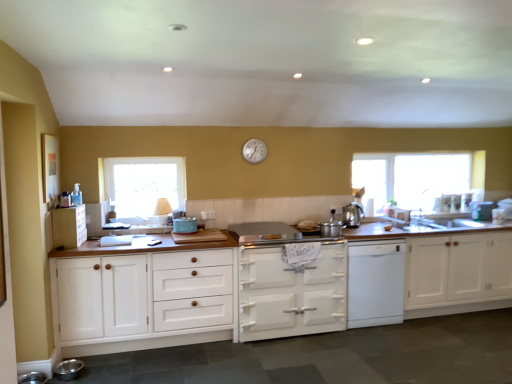
Question: From a real-world perspective, is white glossy stove at center, placed as the 2th cabinetry when sorted from right to left, above or below white wood cabinet at left, acting as the 2th cabinetry starting from the left?

Choices:
 (A) below
 (B) above

Answer: (A)

Question: Is white glossy stove at center, positioned as the 3th cabinetry in left-to-right order, wider or thinner than white wood cabinet at left, the third cabinetry positioned from the right?

Choices:
 (A) wide
 (B) thin

Answer: (A)

Question: Estimate the real-world distances between objects in this image. Which object is closer to the white glossy sink at right, the 5th appliance in the bottom-to-top sequence?

Choices:
 (A) white glossy stove at center, positioned as the 3th cabinetry in left-to-right order
 (B) white wood cabinet at right, positioned as the 1th cabinetry in right-to-left order
 (C) metallic stainless steel bowl at lower left, acting as the fifth appliance starting from the right
 (D) clear glass window at upper right, arranged as the 1th window when viewed from the back
 (E) white wood cabinet at left, acting as the 2th cabinetry starting from the left

Answer: (D)

Question: Based on their relative distances, which object is nearer to the white wood cabinet at left, acting as the 2th cabinetry starting from the left?

Choices:
 (A) polished stainless steel kettle at center right, marked as the second appliance in a back-to-front arrangement
 (B) white glossy sink at right, which ranks as the 1th appliance in right-to-left order
 (C) white matte dishwasher at center
 (D) clear glass window at upper right, arranged as the 1th window when viewed from the back
 (E) white wood cabinet at left, the first cabinetry when ordered from left to right

Answer: (E)